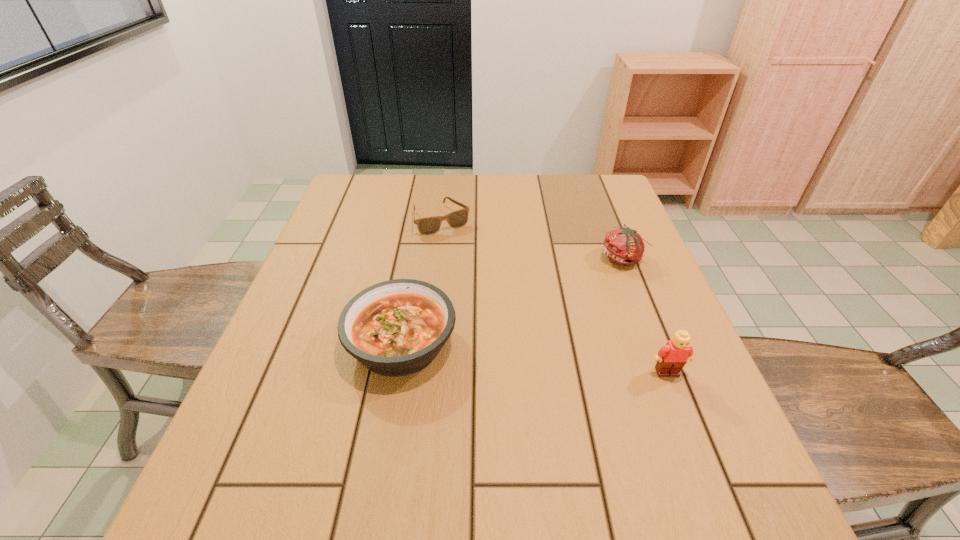
Where is `vacant region located on the frames of the farthest object`? vacant region located on the frames of the farthest object is located at coordinates (516, 329).

Locate an element on the screen. free space located 0.050m on the frames of the farthest object is located at coordinates (459, 245).

Locate an element on the screen. vacant area situated 0.290m on the frames of the farthest object is located at coordinates (496, 300).

What are the coordinates of `object present at the far edge` in the screenshot? It's located at (430, 225).

Where is `object located at the left edge`? object located at the left edge is located at coordinates (394, 328).

Identify the location of Lego located at the right edge. (672, 357).

Where is `tomato located in the right edge section of the desktop`? The image size is (960, 540). tomato located in the right edge section of the desktop is located at coordinates (624, 246).

Identify the location of vacant space at the far edge of the desktop. (493, 178).

Where is `free space at the left edge of the desktop`? free space at the left edge of the desktop is located at coordinates (279, 322).

This screenshot has height=540, width=960. In the image, there is a desktop. In order to click on vacant space at the right edge in this screenshot , I will do `click(644, 392)`.